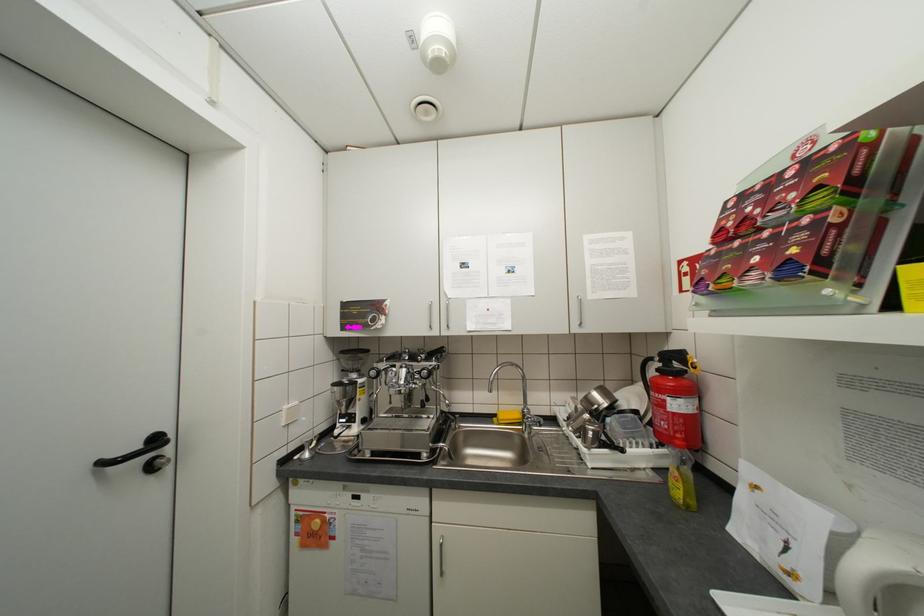
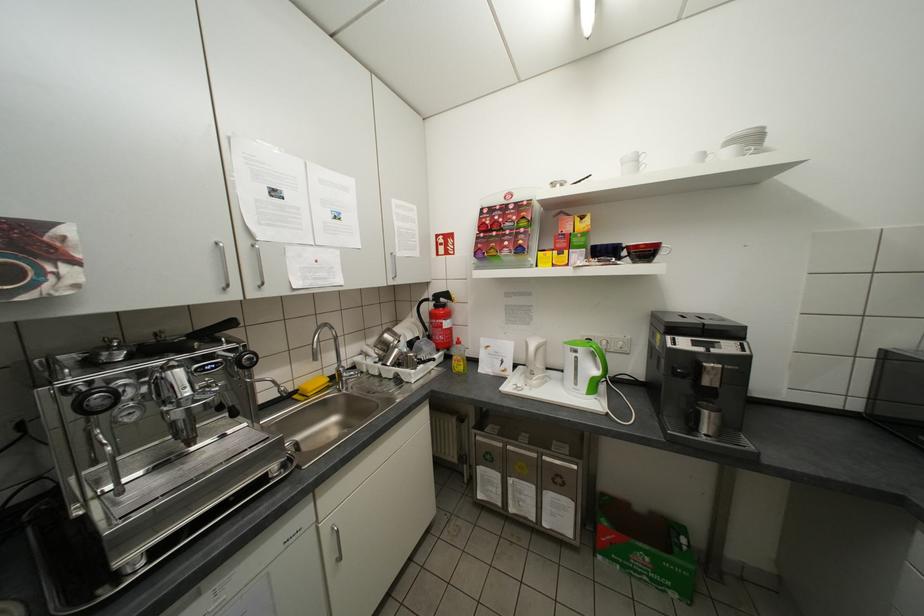
Where in the second image is the point corresponding to the point at 666,370 from the first image?

(444, 306)